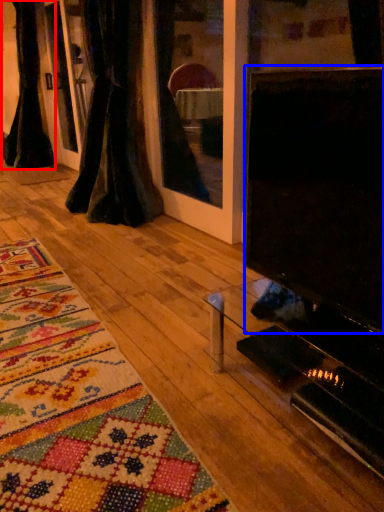
Question: Which point is further to the camera, curtain (highlighted by a red box) or screen (highlighted by a blue box)?

Choices:
 (A) curtain
 (B) screen

Answer: (A)